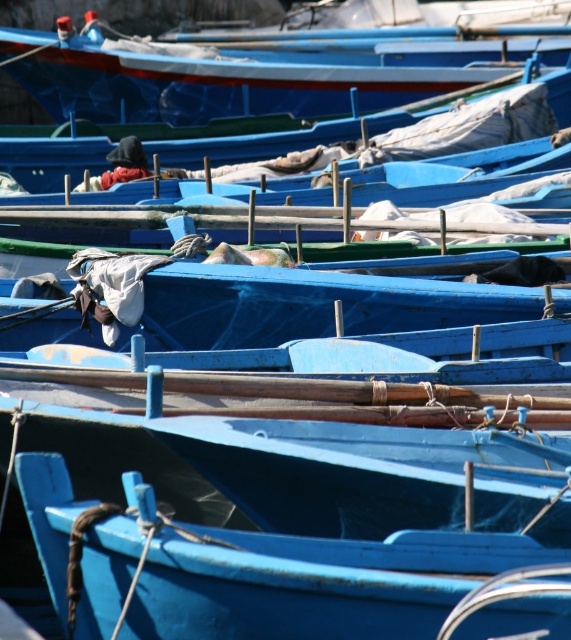
You are standing at the point marked as point (311, 305) in the image. Looking around, you see a blue matte boat at center. Which direction should you face to look directly at the blue matte boat at center?

You are already facing the blue matte boat at center because the point (311, 305) corresponds to the blue matte boat at center.

You are a marine biologist observing the boats in the harbor. You need to choose a boat to board for a quick inspection. Which boat would you choose if you want to select the narrower one between the smooth blue boat at center and the blue matte boat at center?

The smooth blue boat at center is thinner than the blue matte boat at center, so you should choose the smooth blue boat at center for the inspection.

You are standing at the edge of the harbor looking at the boats. Which of the two points, point (x=86, y=564) or point (x=443, y=65), is closer to you?

Point (x=86, y=564) is closer to you than point (x=443, y=65).